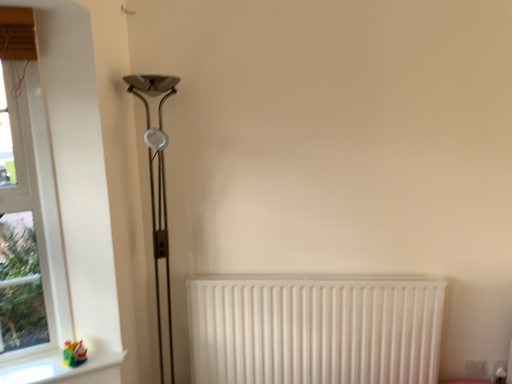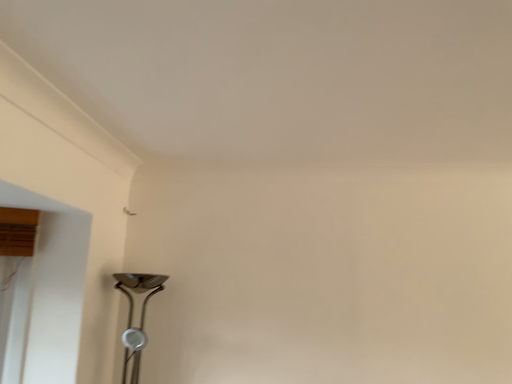
Question: Which way did the camera rotate in the video?

Choices:
 (A) rotated upward
 (B) rotated downward

Answer: (A)